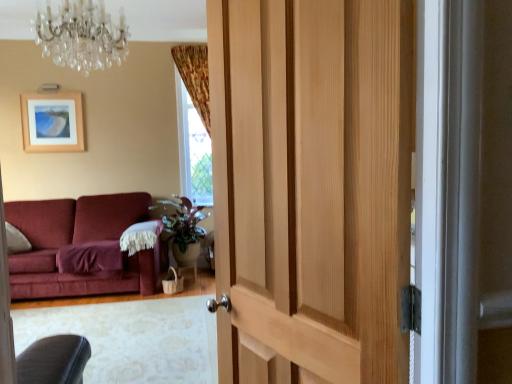
Question: Is green matte plant at center closer to camera compared to wooden picture frame at upper left?

Choices:
 (A) yes
 (B) no

Answer: (A)

Question: Does green matte plant at center have a lesser height compared to wooden picture frame at upper left?

Choices:
 (A) no
 (B) yes

Answer: (A)

Question: Is green matte plant at center turned away from wooden picture frame at upper left?

Choices:
 (A) no
 (B) yes

Answer: (A)

Question: Are green matte plant at center and wooden picture frame at upper left located far from each other?

Choices:
 (A) no
 (B) yes

Answer: (B)

Question: Could you tell me if green matte plant at center is facing wooden picture frame at upper left?

Choices:
 (A) no
 (B) yes

Answer: (A)

Question: In the image, is crystal glass chandelier at upper center positioned in front of or behind green matte plant at center?

Choices:
 (A) behind
 (B) front

Answer: (B)

Question: Is point (96, 6) closer or farther from the camera than point (183, 241)?

Choices:
 (A) closer
 (B) farther

Answer: (A)

Question: Considering the positions of crystal glass chandelier at upper center and green matte plant at center in the image, is crystal glass chandelier at upper center taller or shorter than green matte plant at center?

Choices:
 (A) short
 (B) tall

Answer: (A)

Question: From a real-world perspective, is crystal glass chandelier at upper center positioned above or below green matte plant at center?

Choices:
 (A) below
 (B) above

Answer: (B)

Question: Is crystal glass chandelier at upper center taller or shorter than wooden picture frame at upper left?

Choices:
 (A) tall
 (B) short

Answer: (B)

Question: Relative to wooden picture frame at upper left, is crystal glass chandelier at upper center in front or behind?

Choices:
 (A) behind
 (B) front

Answer: (B)

Question: Considering the positions of crystal glass chandelier at upper center and wooden picture frame at upper left in the image, is crystal glass chandelier at upper center wider or thinner than wooden picture frame at upper left?

Choices:
 (A) wide
 (B) thin

Answer: (A)

Question: Looking at the image, does crystal glass chandelier at upper center seem bigger or smaller compared to wooden picture frame at upper left?

Choices:
 (A) big
 (B) small

Answer: (A)

Question: Considering their positions, is natural wood door at center located in front of or behind green matte plant at center?

Choices:
 (A) behind
 (B) front

Answer: (B)

Question: Based on their positions, is natural wood door at center located to the left or right of green matte plant at center?

Choices:
 (A) right
 (B) left

Answer: (A)